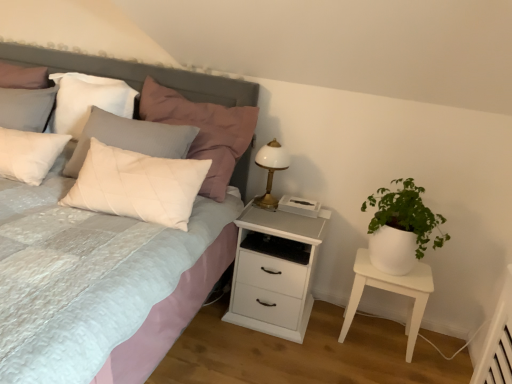
Find the location of a particular element. vacant space in front of white glossy bedside lamp at upper right is located at coordinates (265, 215).